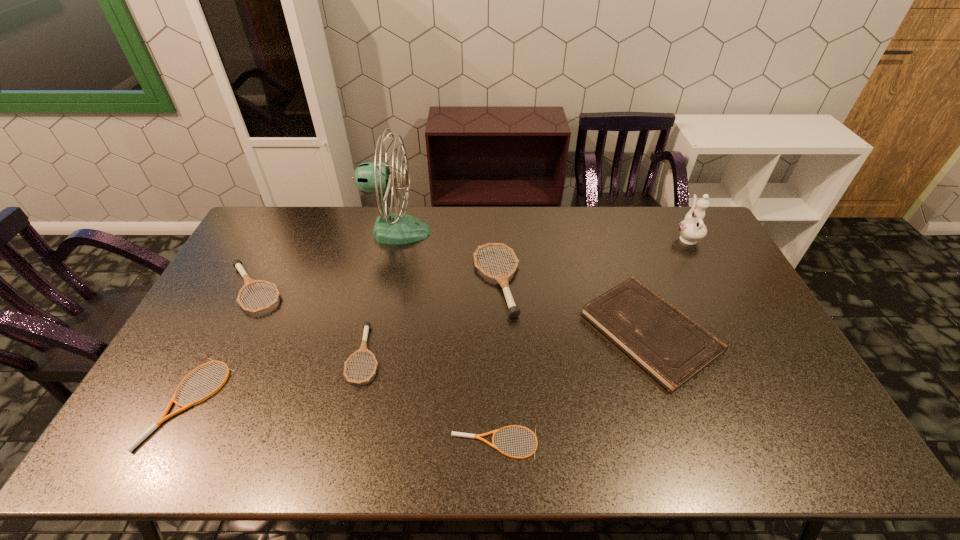
Find the location of a particular element. Image resolution: width=960 pixels, height=540 pixels. blank region between the second tallest object and the left beige tennis racket is located at coordinates (438, 320).

You are a GUI agent. You are given a task and a screenshot of the screen. Output one action in this format:
    pyautogui.click(x=<x>, y=<y>)
    Task: Click on the vacant space that's between the bigger beige tennis racket and the tallest object
    This screenshot has height=540, width=960.
    Given the screenshot: What is the action you would take?
    pyautogui.click(x=293, y=317)

Locate an element on the screen. This screenshot has width=960, height=540. object that is the closest one to the paperback book is located at coordinates (503, 279).

Identify which object is the seventh nearest to the second smallest gray tennis racket. Please provide its 2D coordinates. Your answer should be formatted as a tuple, i.e. [(x, y)], where the tuple contains the x and y coordinates of a point satisfying the conditions above.

[(692, 228)]

Where is `the fourth closest tennis racket relative to the smaller beige tennis racket`? Image resolution: width=960 pixels, height=540 pixels. the fourth closest tennis racket relative to the smaller beige tennis racket is located at coordinates (237, 264).

Identify which tennis racket is the fourth closest to the third tallest tennis racket. Please provide its 2D coordinates. Your answer should be formatted as a tuple, i.e. [(x, y)], where the tuple contains the x and y coordinates of a point satisfying the conditions above.

[(163, 417)]

What are the coordinates of `gray tennis racket that is the closest to the smallest gray tennis racket` in the screenshot? It's located at (503, 279).

Locate which gray tennis racket is the third closest to the fourth tallest tennis racket. Please provide its 2D coordinates. Your answer should be formatted as a tuple, i.e. [(x, y)], where the tuple contains the x and y coordinates of a point satisfying the conditions above.

[(503, 279)]

At what (x,y) coordinates should I click in order to perform the action: click on vacant space that satisfies the following two spatial constraints: 1. on the back side of the second biggest gray tennis racket; 2. on the left side of the bigger beige tennis racket. Please return your answer as a coordinate pair (x, y). Looking at the image, I should click on (249, 289).